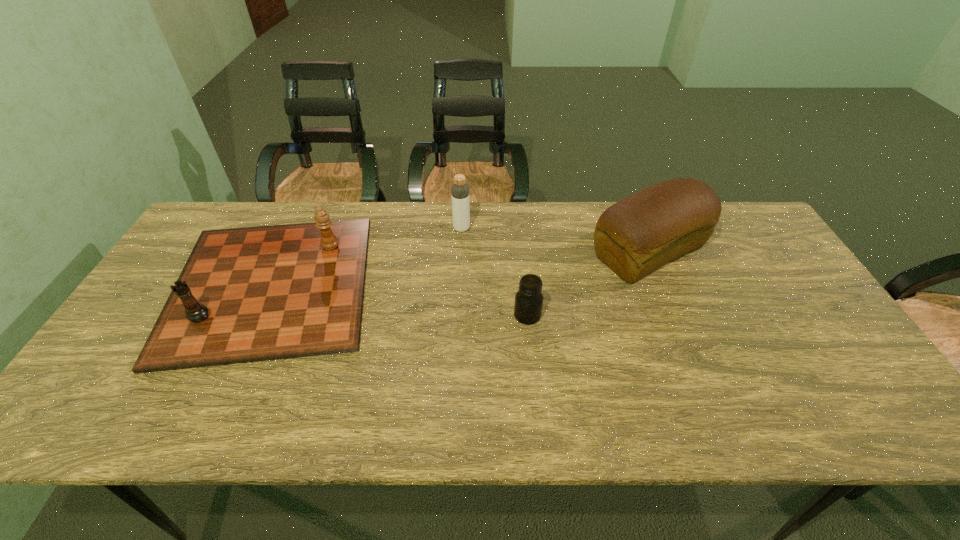
The width and height of the screenshot is (960, 540). I want to click on bottle at the far edge, so click(x=459, y=191).

Locate an element on the screen. This screenshot has width=960, height=540. gameboard at the far edge is located at coordinates (251, 294).

Locate an element on the screen. object located in the left edge section of the desktop is located at coordinates (251, 294).

This screenshot has height=540, width=960. Find the location of `object present at the far left corner`. object present at the far left corner is located at coordinates (251, 294).

The height and width of the screenshot is (540, 960). In the image, there is a desktop. Find the location of `free space at the far edge`. free space at the far edge is located at coordinates (562, 236).

I want to click on blank space at the near edge, so click(660, 431).

Where is `free point at the right edge`? The image size is (960, 540). free point at the right edge is located at coordinates (797, 374).

You are a GUI agent. You are given a task and a screenshot of the screen. Output one action in this format:
    pyautogui.click(x=<x>, y=<y>)
    Task: Click on the free spot between the jar and the leftmost object
    This screenshot has width=960, height=540.
    Given the screenshot: What is the action you would take?
    pyautogui.click(x=399, y=300)

Where is `vacant area between the bread and the bottle`? vacant area between the bread and the bottle is located at coordinates (555, 240).

The image size is (960, 540). Find the location of `vacant area that lies between the bottle and the jar`. vacant area that lies between the bottle and the jar is located at coordinates (494, 272).